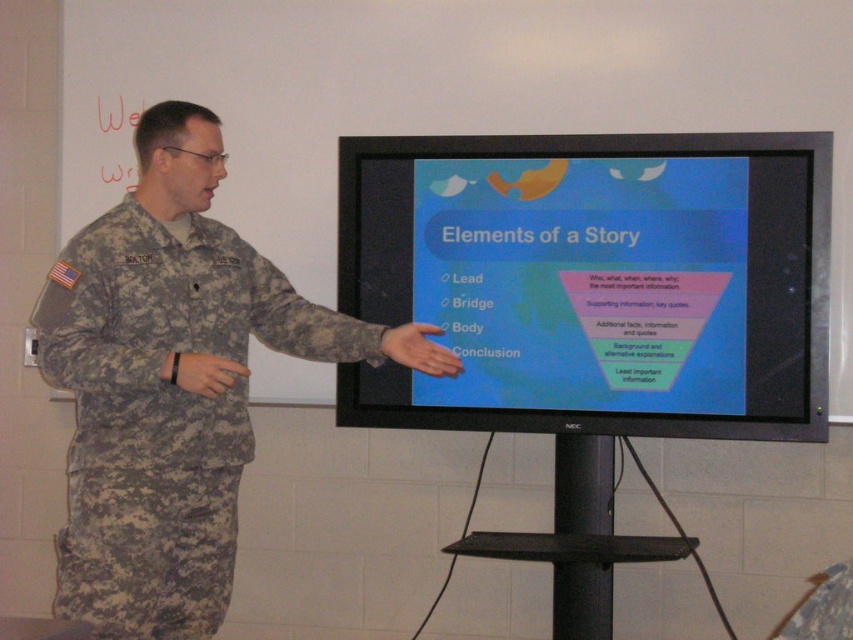
Is matte black monitor at center above camouflage fabric uniform at left?

Correct, matte black monitor at center is located above camouflage fabric uniform at left.

Is point (666, 252) positioned before point (132, 488)?

That is False.

I want to click on matte black monitor at center, so click(x=593, y=282).